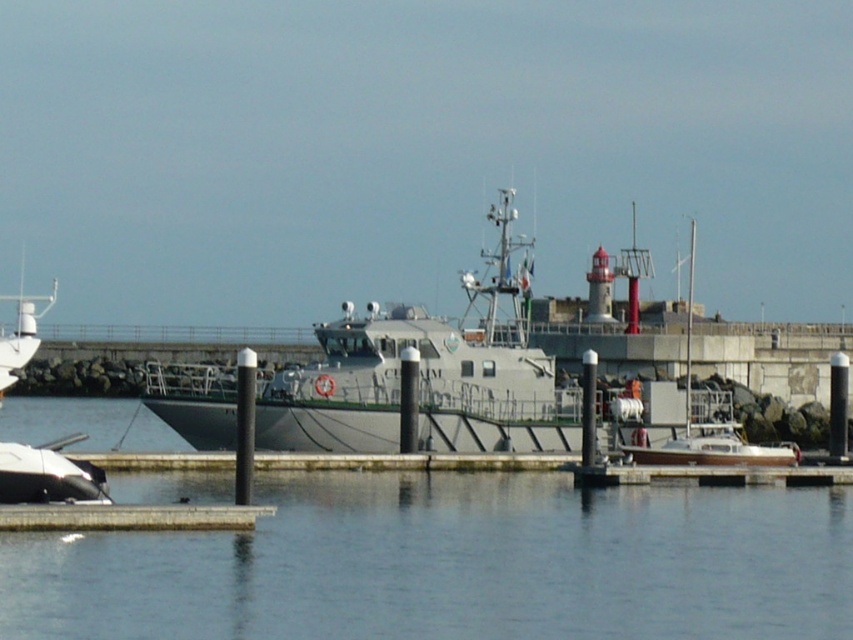
Question: Where is transparent water at center located in relation to gray matte boat at center in the image?

Choices:
 (A) below
 (B) above

Answer: (A)

Question: Which of the following is the farthest from the observer?

Choices:
 (A) (461, 390)
 (B) (73, 477)

Answer: (A)

Question: Is transparent water at center thinner than gray matte boat at center?

Choices:
 (A) no
 (B) yes

Answer: (B)

Question: Observing the image, what is the correct spatial positioning of transparent water at center in reference to white matte boat at lower left?

Choices:
 (A) right
 (B) left

Answer: (A)

Question: Considering the real-world distances, which object is closest to the transparent water at center?

Choices:
 (A) gray matte boat at center
 (B) white matte boat at lower left

Answer: (B)

Question: Among these points, which one is farthest from the camera?

Choices:
 (A) (807, 556)
 (B) (50, 472)

Answer: (B)